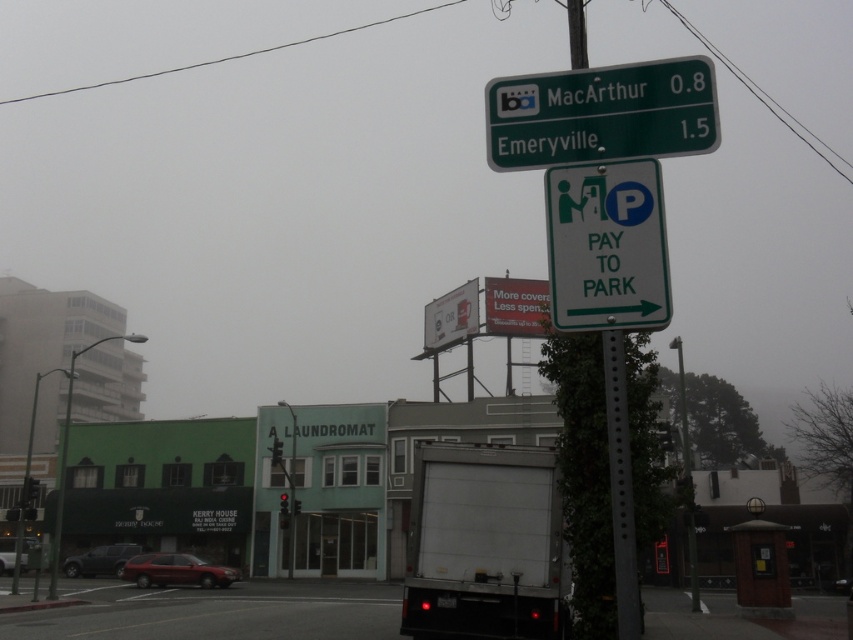
Question: Which of these objects is positioned farthest from the white plastic sign at center right?

Choices:
 (A) green metallic street sign at upper center
 (B) white matte truck at lower center

Answer: (B)

Question: Is green metallic street sign at upper center wider than white plastic sign at center right?

Choices:
 (A) yes
 (B) no

Answer: (A)

Question: Is white matte truck at lower center bigger than green metallic street sign at upper center?

Choices:
 (A) yes
 (B) no

Answer: (B)

Question: Which object is closer to the camera taking this photo?

Choices:
 (A) white matte truck at lower center
 (B) white plastic sign at center right
 (C) green metallic street sign at upper center

Answer: (B)

Question: Where is green metallic street sign at upper center located in relation to white plastic sign at center right in the image?

Choices:
 (A) left
 (B) right

Answer: (B)

Question: Based on their relative distances, which object is farther from the white matte truck at lower center?

Choices:
 (A) white plastic sign at center right
 (B) green metallic street sign at upper center

Answer: (A)